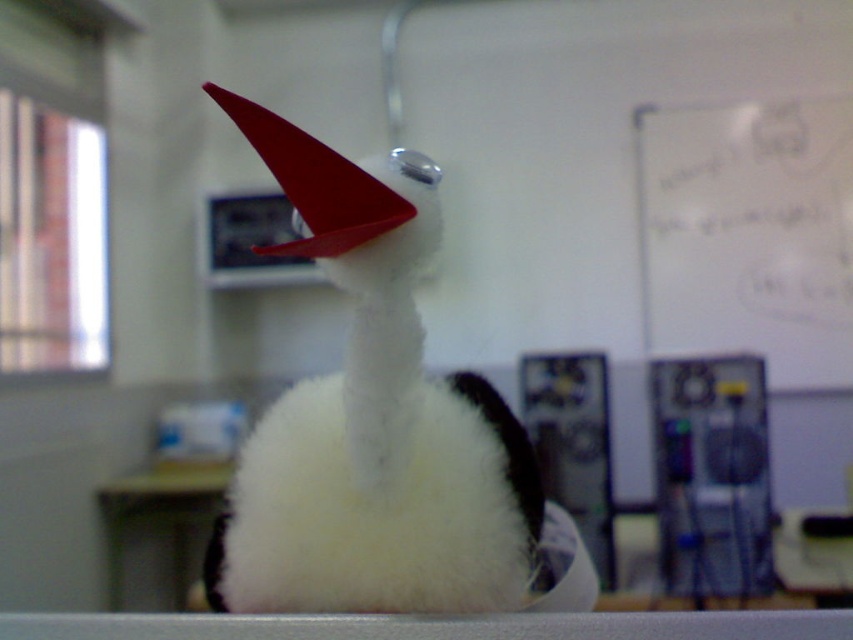
Question: Is the position of white fluffy fur at center less distant than that of white matte board at upper right?

Choices:
 (A) yes
 (B) no

Answer: (A)

Question: Can you confirm if white fluffy fur at center is bigger than white matte table at lower center?

Choices:
 (A) no
 (B) yes

Answer: (A)

Question: Which object is positioned farthest from the white fluffy fur at center?

Choices:
 (A) white matte table at lower center
 (B) white matte board at upper right

Answer: (B)

Question: Which object is the closest to the white matte table at lower center?

Choices:
 (A) white fluffy fur at center
 (B) white matte board at upper right

Answer: (B)

Question: Which point appears farthest from the camera in this image?

Choices:
 (A) (833, 108)
 (B) (352, 516)

Answer: (A)

Question: Can you confirm if white fluffy fur at center is positioned below white matte table at lower center?

Choices:
 (A) yes
 (B) no

Answer: (B)